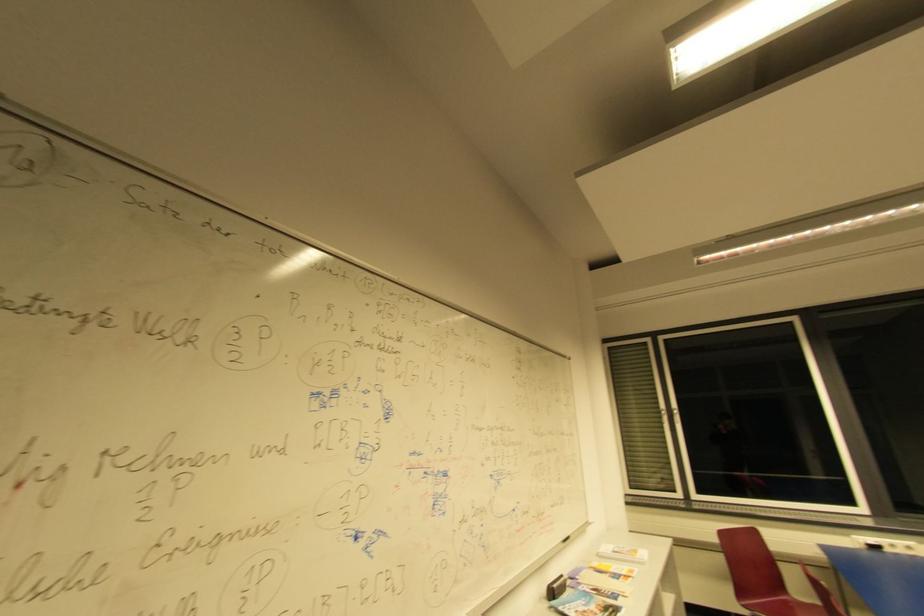
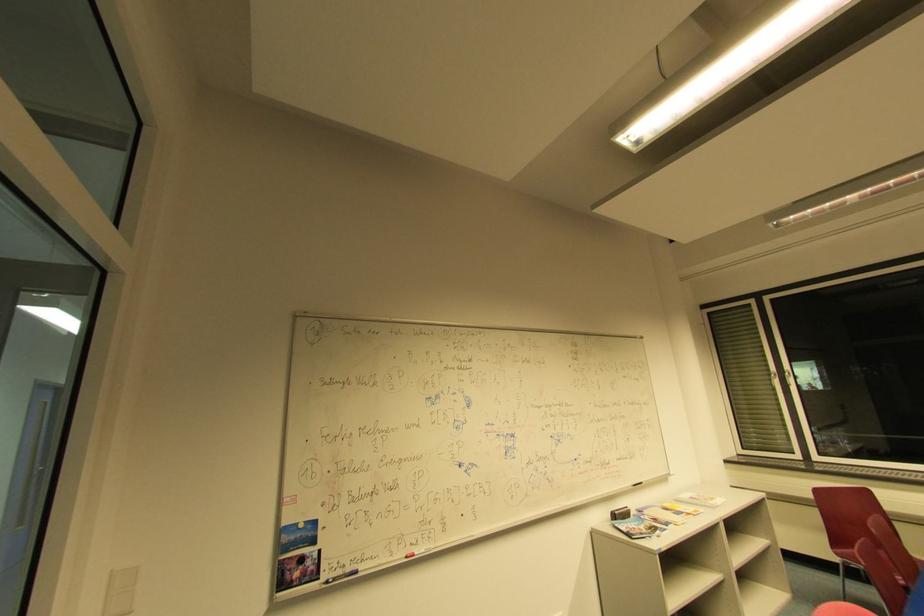
Question: The images are taken continuously from a first-person perspective. In which direction is your viewpoint rotating?

Choices:
 (A) Left
 (B) Right
 (C) Up
 (D) Down

Answer: (A)